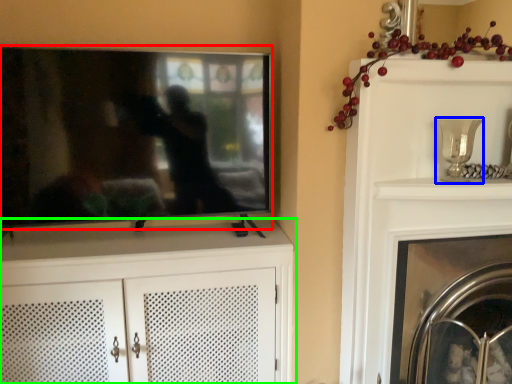
Question: Which object is positioned farthest from television (highlighted by a red box)? Select from candle holder (highlighted by a blue box) and cabinetry (highlighted by a green box).

Choices:
 (A) candle holder
 (B) cabinetry

Answer: (A)